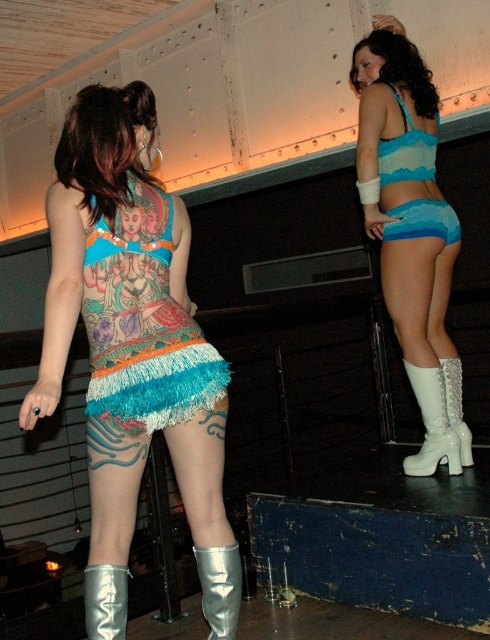
Between point (377, 56) and point (399, 227), which one is positioned behind?

The point (377, 56) is more distant.

Is point (433, 438) farther from camera compared to point (419, 204)?

Yes, point (433, 438) is farther from viewer.

Locate an element on the screen. This screenshot has width=490, height=640. matte blue fabric bikini top at upper right is located at coordinates (411, 230).

Is point (39, 394) positioned after point (139, 346)?

No, (39, 394) is in front of (139, 346).

Does shiny silver boots at center have a smaller size compared to turquoise fringe dress at center?

No, shiny silver boots at center is not smaller than turquoise fringe dress at center.

Is point (140, 413) positioned behind point (131, 289)?

No, it is in front of (131, 289).

Where is `shiny silver boots at center`? The image size is (490, 640). shiny silver boots at center is located at coordinates (128, 323).

Can you confirm if shiny silver boots at center is thinner than white glossy boot at right?

In fact, shiny silver boots at center might be wider than white glossy boot at right.

Which is more to the left, shiny silver boots at center or white glossy boot at right?

Positioned to the left is shiny silver boots at center.

What do you see at coordinates (128, 323) in the screenshot? Image resolution: width=490 pixels, height=640 pixels. I see `shiny silver boots at center` at bounding box center [128, 323].

Image resolution: width=490 pixels, height=640 pixels. I want to click on shiny silver boots at center, so click(x=128, y=323).